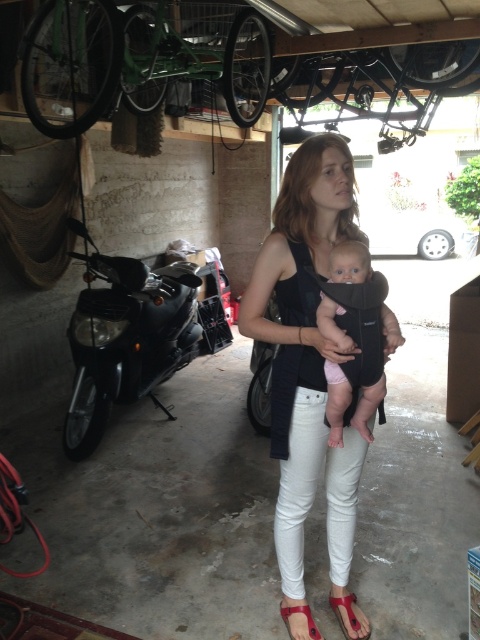
You are a photographer setting up a shot in this garage scene. You want to focus on the white matte tank top at center without the scooter in the background. Is the distance between them sufficient to ensure the scooter won

The white matte tank top at center is 1.61 meters from the camera. Since the scooter is further back in the background, the distance should be sufficient to blur the scooter out of focus if using a shallow depth of field.

Consider the image. You are standing at the entrance of the garage and see two points marked in the scene. The first point is at coordinates point (330,310) and the second is at point (348,620). Which point is closer to you?

Point (330,310) is in front of point (348,620), so the first point is closer to you.